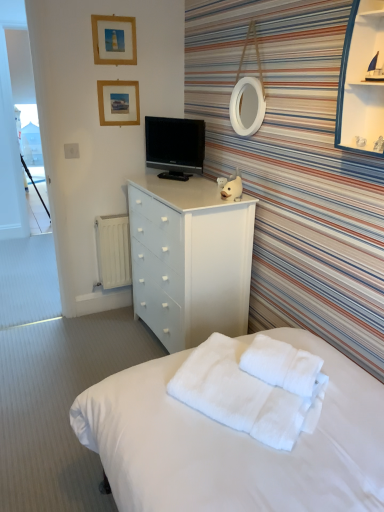
I want to click on free space above white matte chest of drawers at center (from a real-world perspective), so click(x=186, y=185).